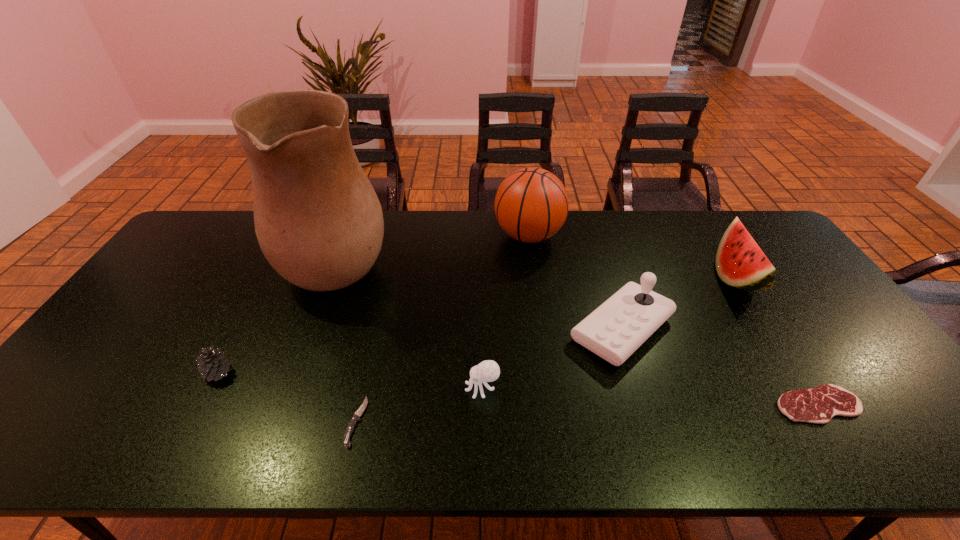
Where is `vacant space at the near right corner of the desktop`? vacant space at the near right corner of the desktop is located at coordinates (900, 443).

Identify the location of unoccupied position between the cream pitcher and the pinecone. Image resolution: width=960 pixels, height=540 pixels. (278, 314).

Identify the location of vacant space that's between the steak and the joystick. Image resolution: width=960 pixels, height=540 pixels. (720, 367).

Where is `empty location between the joystick and the basketball`? The height and width of the screenshot is (540, 960). empty location between the joystick and the basketball is located at coordinates (575, 282).

Find the location of `vacant area between the watermelon and the tallest object`. vacant area between the watermelon and the tallest object is located at coordinates (537, 267).

Find the location of a particular element. unoccupied position between the pinecone and the tallest object is located at coordinates [278, 314].

Where is `empty space between the octopus and the steak`? Image resolution: width=960 pixels, height=540 pixels. empty space between the octopus and the steak is located at coordinates (650, 396).

You are a GUI agent. You are given a task and a screenshot of the screen. Output one action in this format:
    pyautogui.click(x=<x>, y=<y>)
    Task: Click on the vacant space that's between the watermelon and the pinecone
    
    Given the screenshot: What is the action you would take?
    pyautogui.click(x=476, y=325)

I want to click on vacant area between the steak and the watermelon, so [777, 341].

At what (x,y) coordinates should I click in order to perform the action: click on object that is the seventh closest to the pocketknife. Please return your answer as a coordinate pair (x, y). This screenshot has height=540, width=960. Looking at the image, I should click on (740, 262).